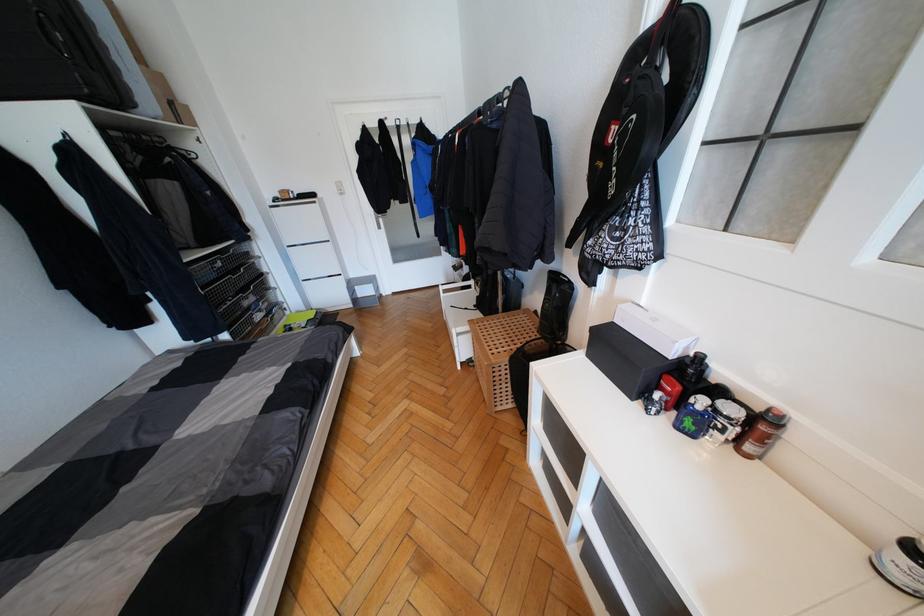
Find where to lift the brown spray bottle. Please return your answer as a coordinate pair (x, y).

(760, 432)